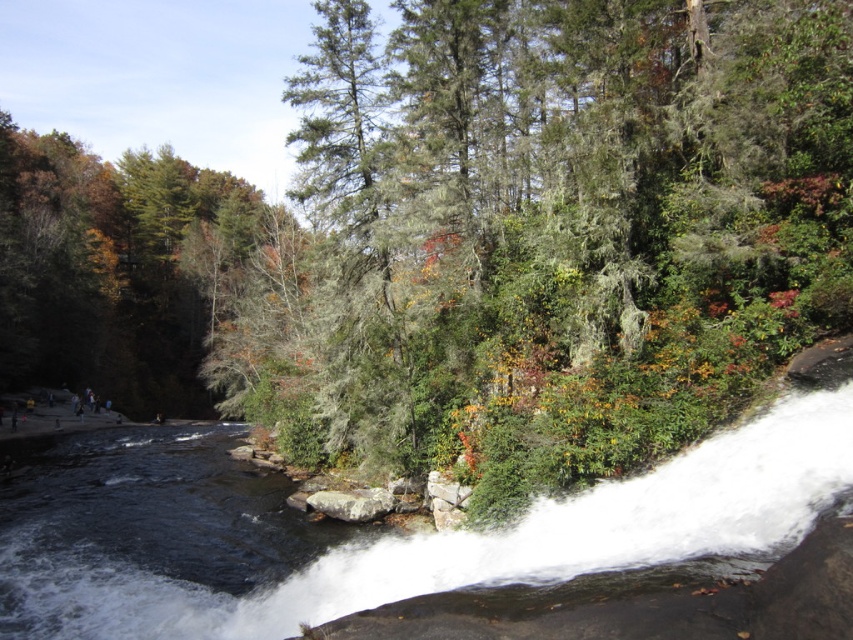
Does white frothy water at lower center have a greater width compared to gray rough rock at center?

Yes.

Which is behind, point (759, 451) or point (376, 492)?

The point (376, 492) is more distant.

Find the location of a particular element. white frothy water at lower center is located at coordinates (373, 536).